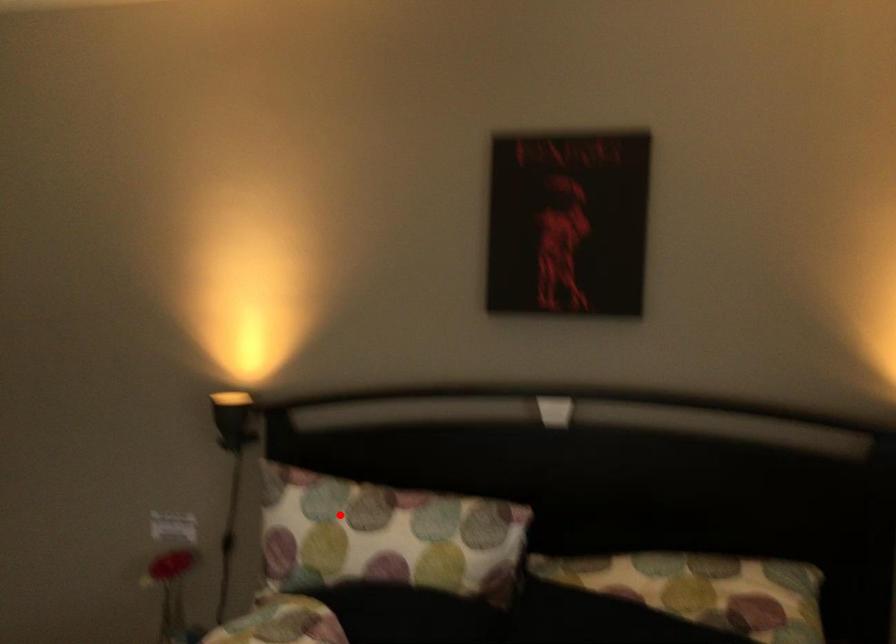
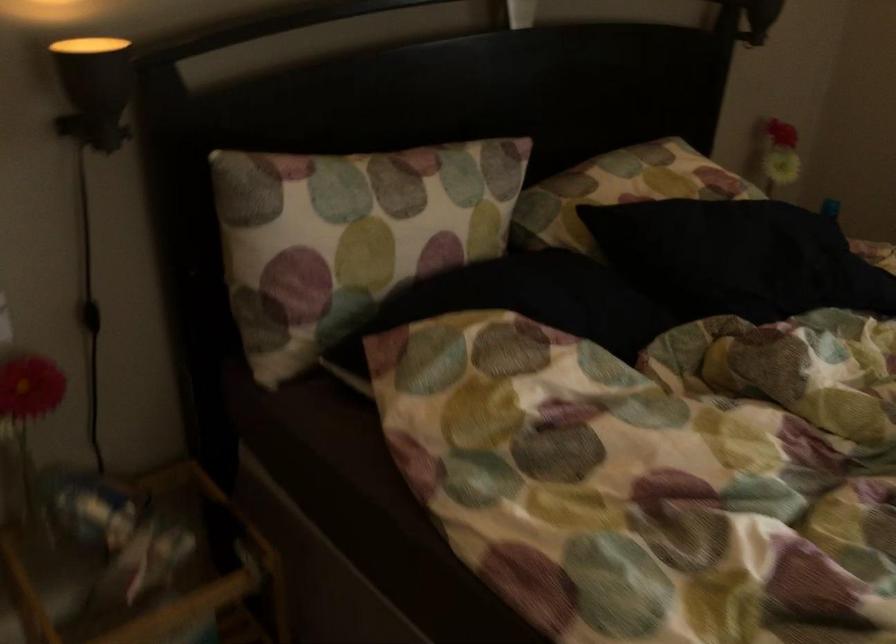
Question: I am providing you with two images of the same scene from different viewpoints. Image1 has a red point marked. In image2, the corresponding 3D location appears at what relative position? Reply with the corresponding letter.

Choices:
 (A) Closer
 (B) Farther

Answer: (A)